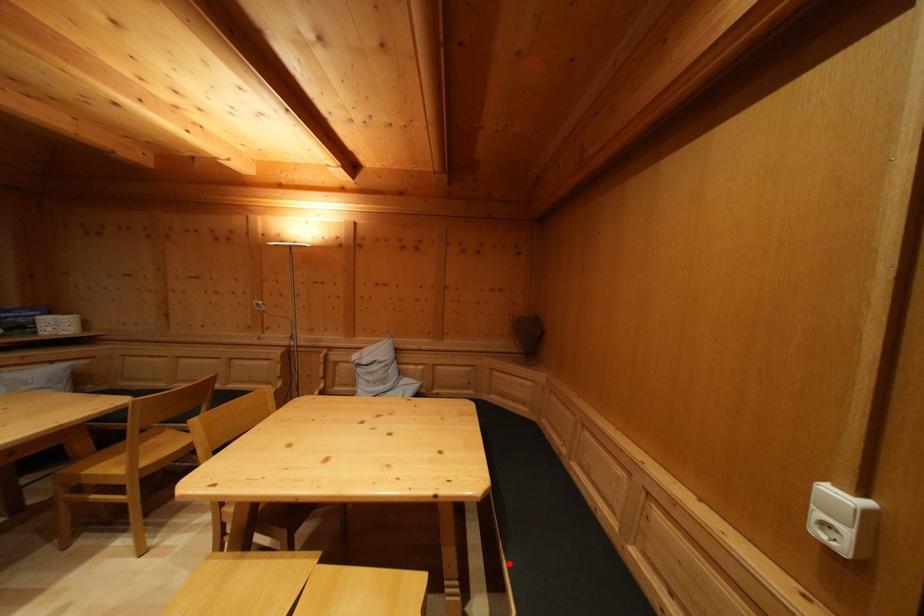
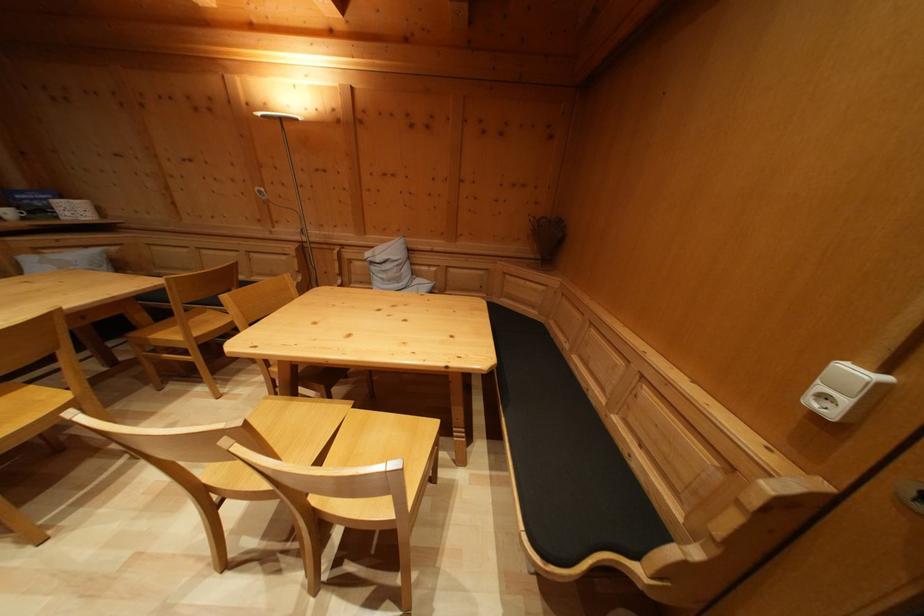
Question: I am providing you with two images of the same scene from different viewpoints. Image1 has a red point marked. In image2, the corresponding 3D location appears at what relative position? Reply with the corresponding letter.

Choices:
 (A) Closer
 (B) Farther

Answer: (A)